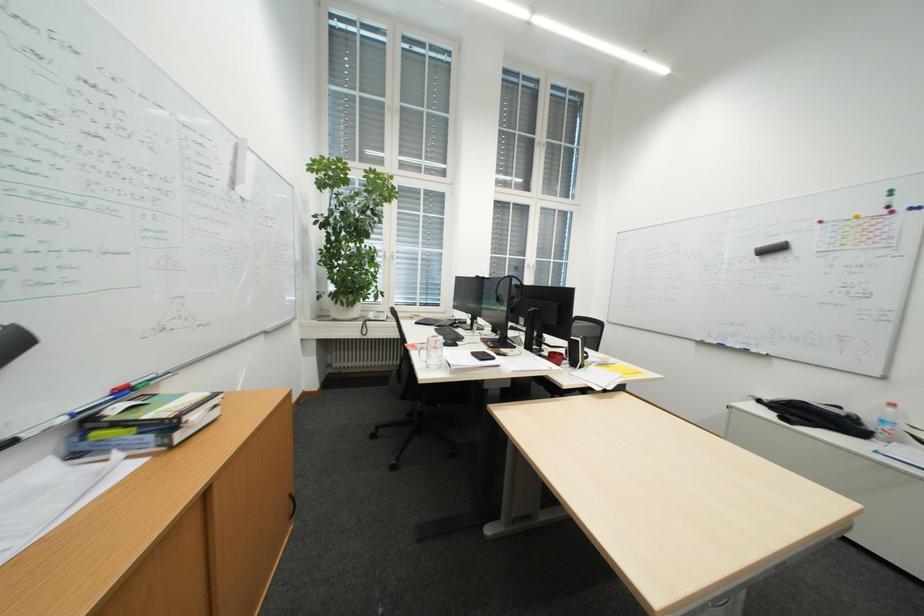
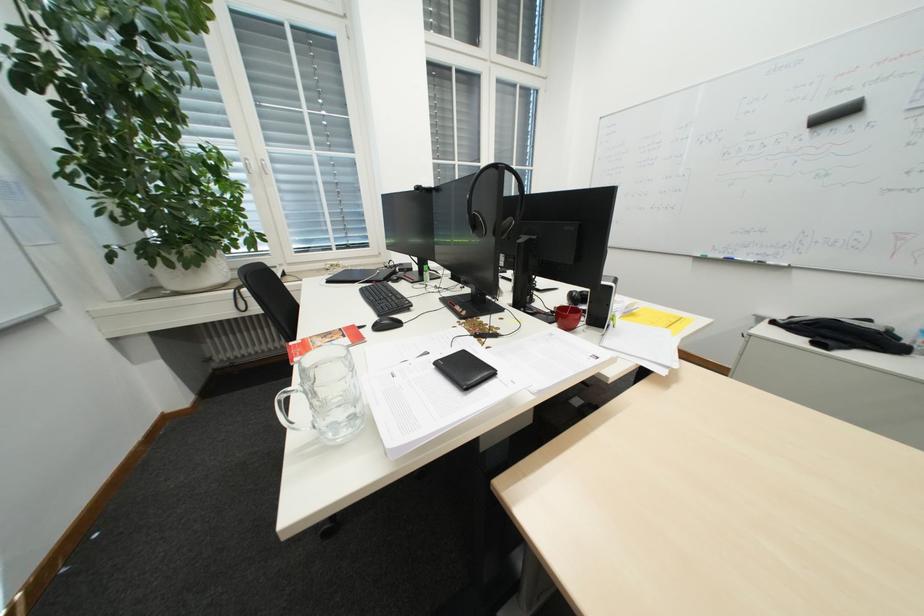
Question: In a continuous first-person perspective shot, in which direction is the camera moving?

Choices:
 (A) Left
 (B) Right
 (C) Forward
 (D) Backward

Answer: (C)